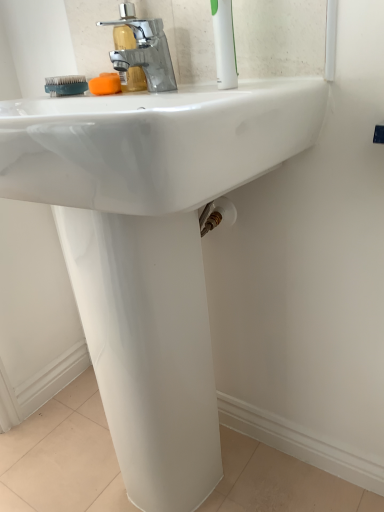
This screenshot has width=384, height=512. Find the location of `free location in front of teal rubber brush at upper left`. free location in front of teal rubber brush at upper left is located at coordinates (81, 98).